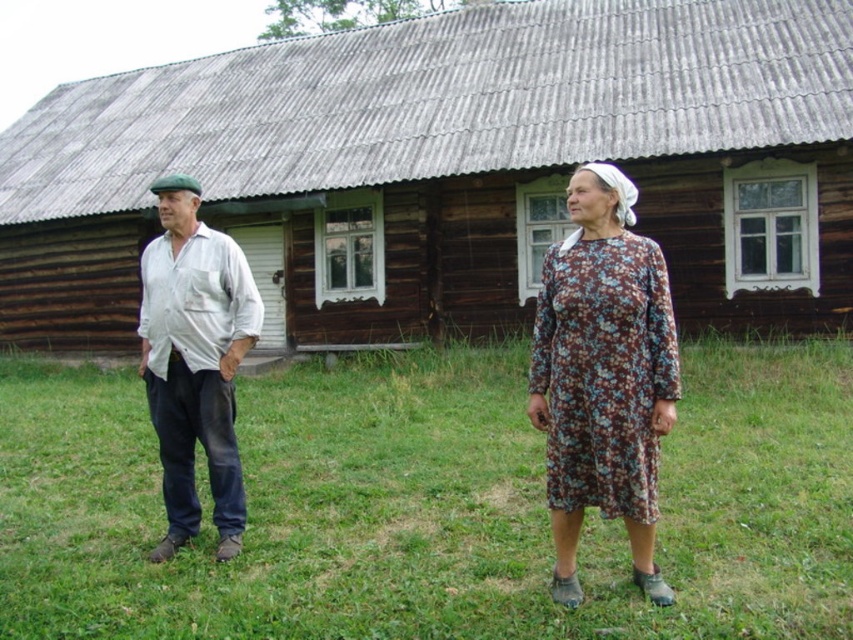
You are a photographer wanting to capture both the wooden hut at center and the floral cotton dress at center in the same frame. Based on their positions, which object should you focus on first to ensure both are in the shot?

The wooden hut at center is positioned on the left side of floral cotton dress at center, so you should focus on the floral cotton dress at center first to ensure both are in the shot.

You are standing at point [451,170] in the scene. What is located at this point?

The wooden hut at center is located at point [451,170].